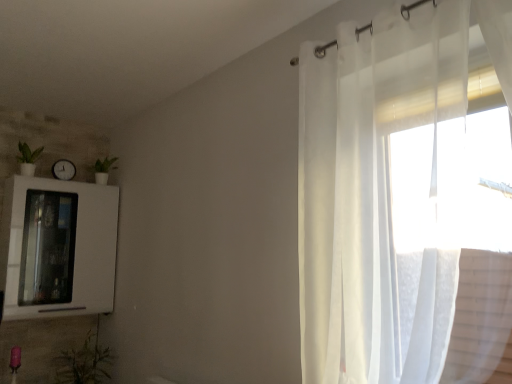
Question: Can you confirm if sheer white curtain at right is positioned to the left of green leafy plant at lower left, the first plant when ordered from right to left?

Choices:
 (A) yes
 (B) no

Answer: (B)

Question: Would you consider sheer white curtain at right to be distant from green leafy plant at lower left, which is the first plant from bottom to top?

Choices:
 (A) yes
 (B) no

Answer: (A)

Question: From the image's perspective, would you say sheer white curtain at right is positioned over green leafy plant at lower left, which ranks as the 2th plant in top-to-bottom order?

Choices:
 (A) yes
 (B) no

Answer: (A)

Question: Considering the relative sizes of sheer white curtain at right and green leafy plant at lower left, arranged as the second plant when viewed from the left, in the image provided, is sheer white curtain at right wider than green leafy plant at lower left, arranged as the second plant when viewed from the left,?

Choices:
 (A) no
 (B) yes

Answer: (A)

Question: Can you confirm if sheer white curtain at right is bigger than green leafy plant at lower left, the first plant when ordered from right to left?

Choices:
 (A) no
 (B) yes

Answer: (B)

Question: Can you confirm if sheer white curtain at right is shorter than green leafy plant at lower left, which ranks as the 2th plant in top-to-bottom order?

Choices:
 (A) yes
 (B) no

Answer: (B)

Question: Is white glossy clock at upper left next to green leafy plant at lower left, which is the first plant from bottom to top, and touching it?

Choices:
 (A) yes
 (B) no

Answer: (B)

Question: Is white glossy clock at upper left surrounding green leafy plant at lower left, the first plant when ordered from right to left?

Choices:
 (A) no
 (B) yes

Answer: (A)

Question: Can we say white glossy clock at upper left lies outside green leafy plant at lower left, which is the first plant from bottom to top?

Choices:
 (A) no
 (B) yes

Answer: (B)

Question: From the image's perspective, is white glossy clock at upper left on green leafy plant at lower left, the first plant when ordered from right to left?

Choices:
 (A) no
 (B) yes

Answer: (B)

Question: Is white glossy clock at upper left to the left of green leafy plant at lower left, arranged as the second plant when viewed from the left, from the viewer's perspective?

Choices:
 (A) yes
 (B) no

Answer: (A)

Question: Does white glossy clock at upper left appear on the right side of green leafy plant at lower left, the first plant when ordered from right to left?

Choices:
 (A) no
 (B) yes

Answer: (A)

Question: Is green matte plant at left, the first plant in the top-to-bottom sequence, to the right of white glossy medicine cabinet at left from the viewer's perspective?

Choices:
 (A) yes
 (B) no

Answer: (B)